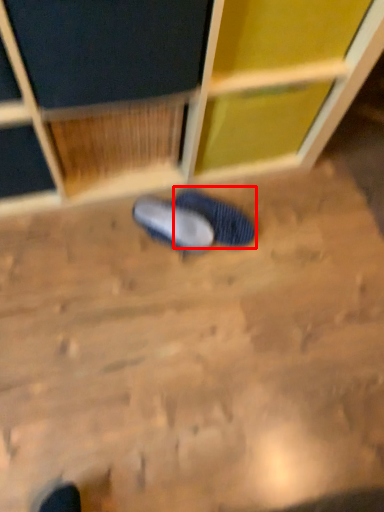
Question: Observing the image, what is the correct spatial positioning of footwear (annotated by the red box) in reference to footwear?

Choices:
 (A) left
 (B) right

Answer: (B)